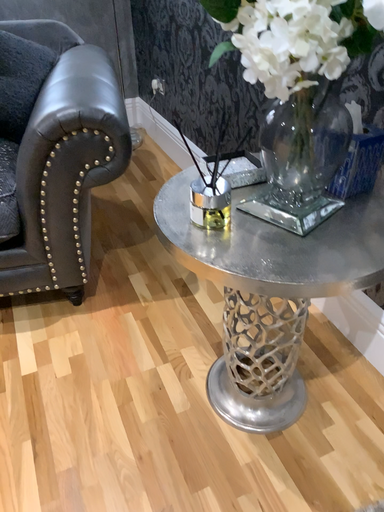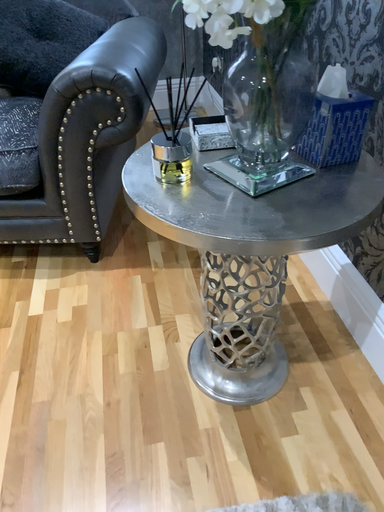
Question: Which way did the camera rotate in the video?

Choices:
 (A) rotated left
 (B) rotated right

Answer: (A)